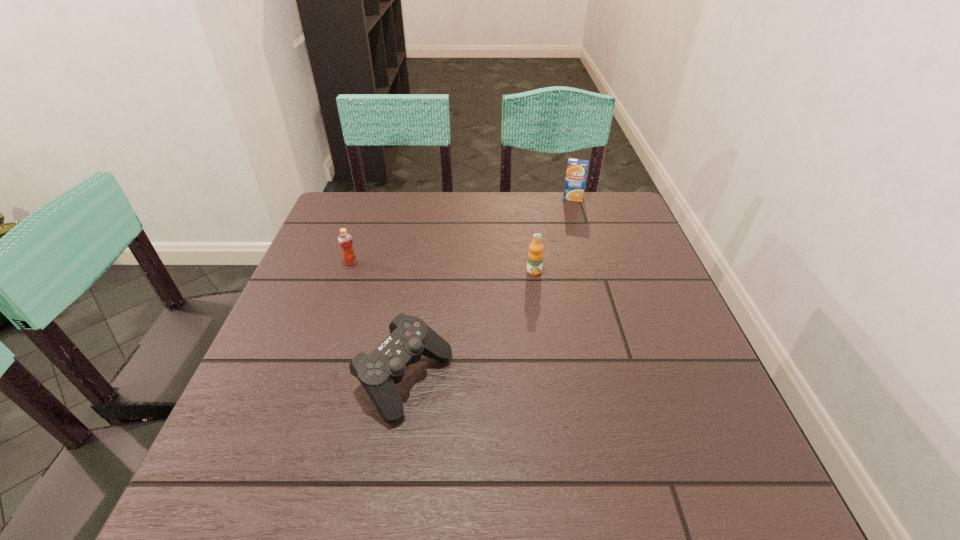
This screenshot has height=540, width=960. Identify the location of vacant space located on the right of the second nearest orange juice. (505, 262).

In order to click on free region located 0.160m on the right of the second object from left to right in this screenshot , I will do `click(536, 381)`.

Where is `object positioned at the far edge`? The width and height of the screenshot is (960, 540). object positioned at the far edge is located at coordinates (577, 169).

Identify the location of object that is at the left edge. (345, 240).

Identify the location of object present at the right edge. (577, 169).

I want to click on object located in the far right corner section of the desktop, so click(577, 169).

You are a GUI agent. You are given a task and a screenshot of the screen. Output one action in this format:
    pyautogui.click(x=<x>, y=<y>)
    Task: Click on the free space at the far edge of the desktop
    
    Given the screenshot: What is the action you would take?
    point(487,192)

Locate an element on the screen. The height and width of the screenshot is (540, 960). vacant space at the near edge of the desktop is located at coordinates (498, 510).

Image resolution: width=960 pixels, height=540 pixels. Identify the location of vacant space at the left edge. coord(289,428).

In the image, there is a desktop. Identify the location of vacant area at the right edge. The height and width of the screenshot is (540, 960). (733, 451).